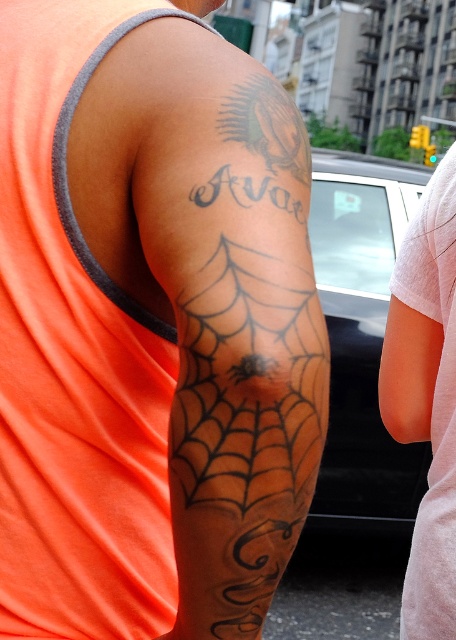
Can you confirm if black ink spiderweb tattoo at upper right is smaller than white cotton shirt at right?

Correct, black ink spiderweb tattoo at upper right occupies less space than white cotton shirt at right.

Does point (274, 518) lie in front of point (444, 461)?

Yes.

Locate an element on the screen. black ink spiderweb tattoo at upper right is located at coordinates (236, 346).